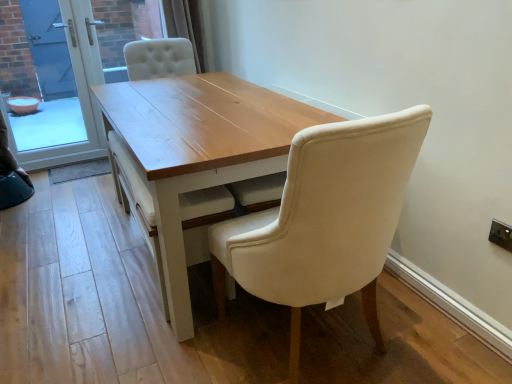
Where is `free region under matte cream chair at center (from a real-world perspective)`? This screenshot has height=384, width=512. free region under matte cream chair at center (from a real-world perspective) is located at coordinates (312, 343).